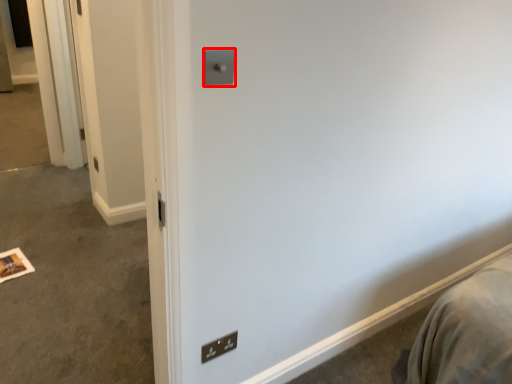
Question: In this image, where is light switch (annotated by the red box) located relative to light switch?

Choices:
 (A) left
 (B) right

Answer: (B)